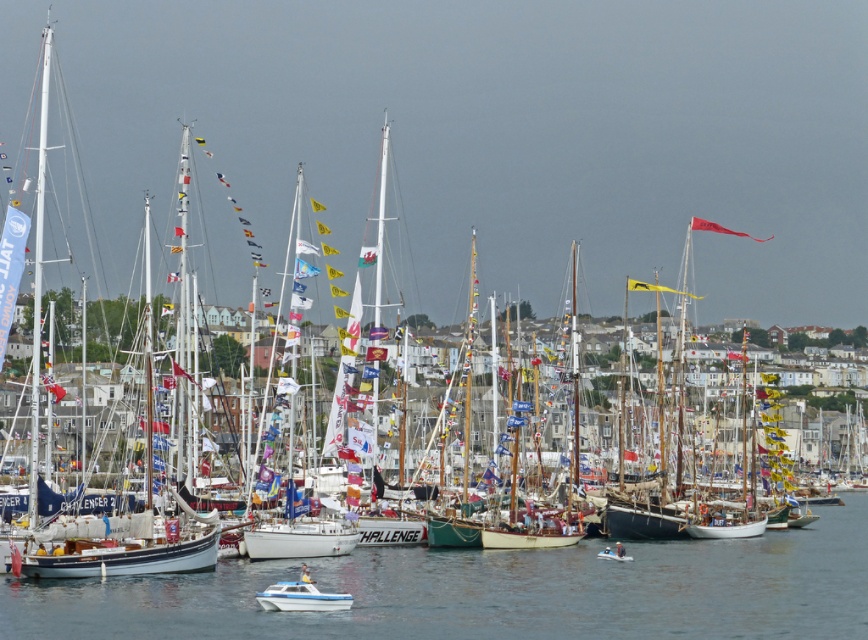
Question: Does clear blue water at center have a larger size compared to white glossy boat at lower center?

Choices:
 (A) yes
 (B) no

Answer: (A)

Question: Among these objects, which one is nearest to the camera?

Choices:
 (A) white glossy boat at lower center
 (B) clear blue water at center

Answer: (B)

Question: Which point appears farthest from the camera in this image?

Choices:
 (A) (260, 593)
 (B) (847, 512)

Answer: (B)

Question: Which object appears closest to the camera in this image?

Choices:
 (A) clear blue water at center
 (B) white glossy boat at lower center

Answer: (A)

Question: Can you confirm if clear blue water at center is smaller than white glossy boat at lower center?

Choices:
 (A) yes
 (B) no

Answer: (B)

Question: Does clear blue water at center have a lesser width compared to white glossy boat at lower center?

Choices:
 (A) no
 (B) yes

Answer: (A)